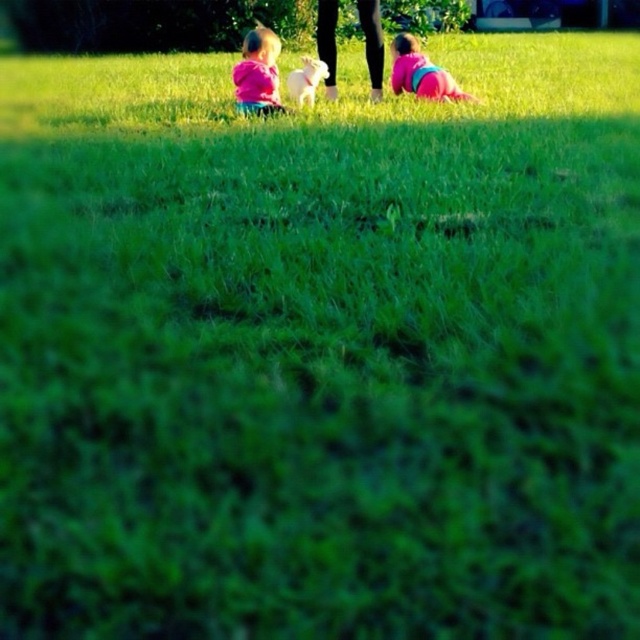
Question: Which point is closer to the camera?

Choices:
 (A) (406, 44)
 (B) (269, 65)

Answer: (B)

Question: Is pink matte shirt at center bigger than pink fabric baby at lower right?

Choices:
 (A) no
 (B) yes

Answer: (A)

Question: Which of the following is the closest to the observer?

Choices:
 (A) pink matte shirt at center
 (B) pink fabric baby at lower right

Answer: (A)

Question: Is pink matte shirt at center above pink fabric baby at lower right?

Choices:
 (A) no
 (B) yes

Answer: (A)

Question: Is pink matte shirt at center smaller than pink fabric baby at lower right?

Choices:
 (A) yes
 (B) no

Answer: (A)